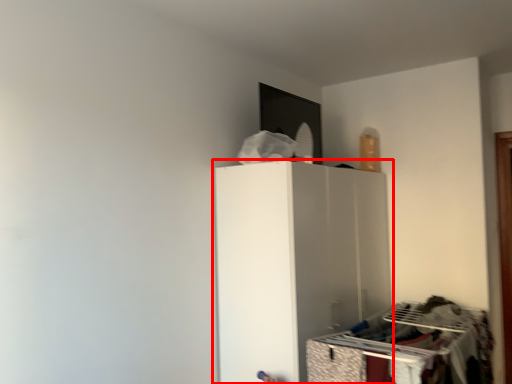
Question: From the image's perspective, considering the relative positions of furniture (annotated by the red box) and drawer in the image provided, where is furniture (annotated by the red box) located with respect to the staircase?

Choices:
 (A) above
 (B) below

Answer: (A)